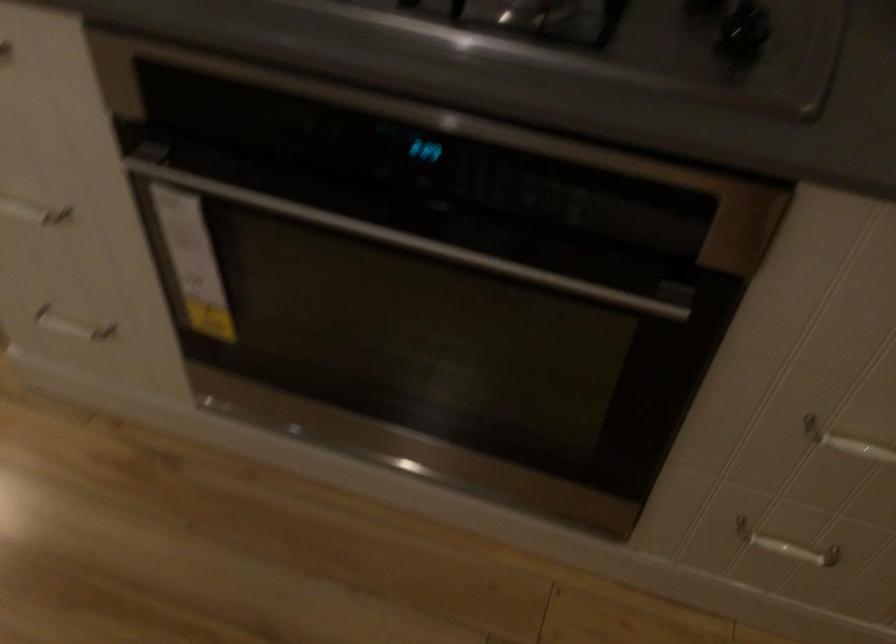
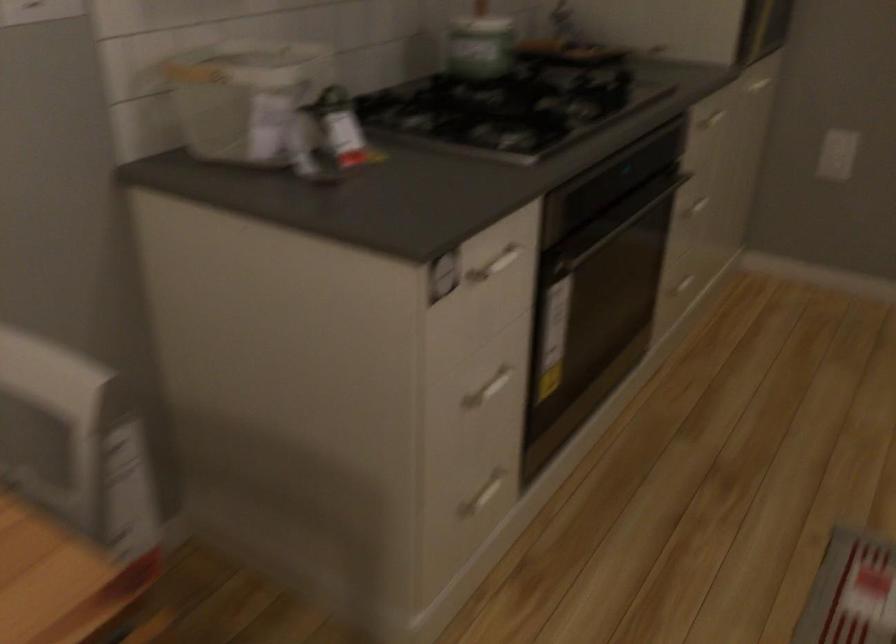
In the second image, find the point that corresponds to point (116, 336) in the first image.

(484, 494)